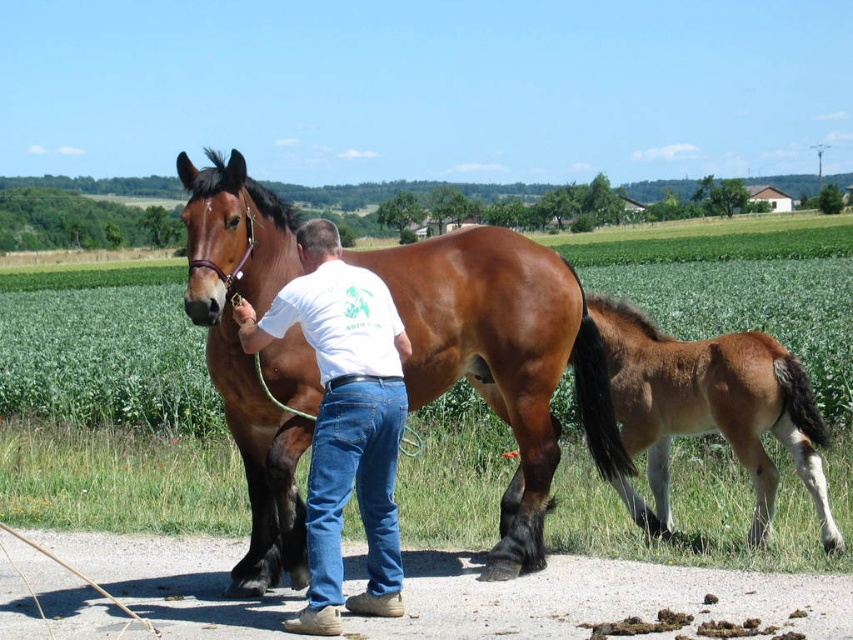
Question: Which object is farther from the camera taking this photo?

Choices:
 (A) brown glossy horse at center
 (B) white cotton shirt at center
 (C) brown glossy foal at lower right

Answer: (A)

Question: Can you confirm if white cotton shirt at center is positioned to the right of brown glossy foal at lower right?

Choices:
 (A) no
 (B) yes

Answer: (A)

Question: Does brown glossy horse at center appear on the right side of brown glossy foal at lower right?

Choices:
 (A) no
 (B) yes

Answer: (A)

Question: Which object appears farthest from the camera in this image?

Choices:
 (A) brown glossy foal at lower right
 (B) brown glossy horse at center

Answer: (B)

Question: Estimate the real-world distances between objects in this image. Which object is farther from the brown glossy horse at center?

Choices:
 (A) white cotton shirt at center
 (B) brown glossy foal at lower right

Answer: (A)

Question: Is white cotton shirt at center below brown glossy foal at lower right?

Choices:
 (A) no
 (B) yes

Answer: (A)